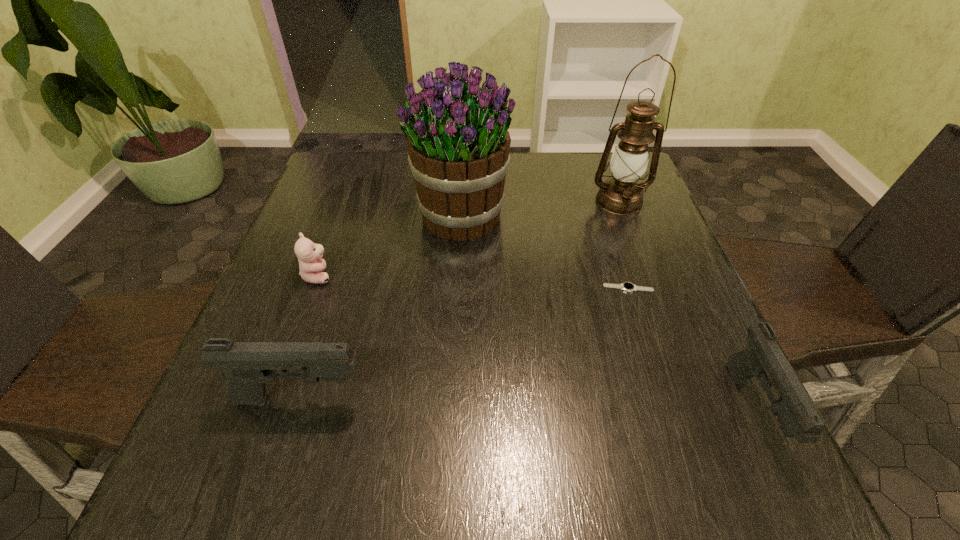
Where is `free space located 0.110m on the front of the oil lamp`? free space located 0.110m on the front of the oil lamp is located at coordinates (636, 244).

This screenshot has height=540, width=960. In order to click on free space located on the left of the shortest object in this screenshot , I will do `click(451, 288)`.

This screenshot has width=960, height=540. In order to click on free space located 0.060m at the face of the teddy bear in this screenshot , I will do `click(360, 275)`.

Where is `bouquet that is at the far edge`? The image size is (960, 540). bouquet that is at the far edge is located at coordinates (458, 145).

At what (x,y) coordinates should I click in order to perform the action: click on oil lamp present at the far edge. Please return your answer as a coordinate pair (x, y). Looking at the image, I should click on (622, 195).

The width and height of the screenshot is (960, 540). I want to click on pistol located in the left edge section of the desktop, so click(249, 365).

This screenshot has width=960, height=540. Identify the location of teddy bear situated at the left edge. (311, 266).

You are a GUI agent. You are given a task and a screenshot of the screen. Output one action in this format:
    pyautogui.click(x=<x>, y=<y>)
    Task: Click on the pistol that is at the right edge
    Image resolution: width=960 pixels, height=540 pixels.
    Given the screenshot: What is the action you would take?
    pyautogui.click(x=763, y=358)

Find the location of `oil lamp that is at the right edge`. oil lamp that is at the right edge is located at coordinates (622, 195).

Locate an element on the screen. Image resolution: width=960 pixels, height=540 pixels. watch located at the right edge is located at coordinates (629, 287).